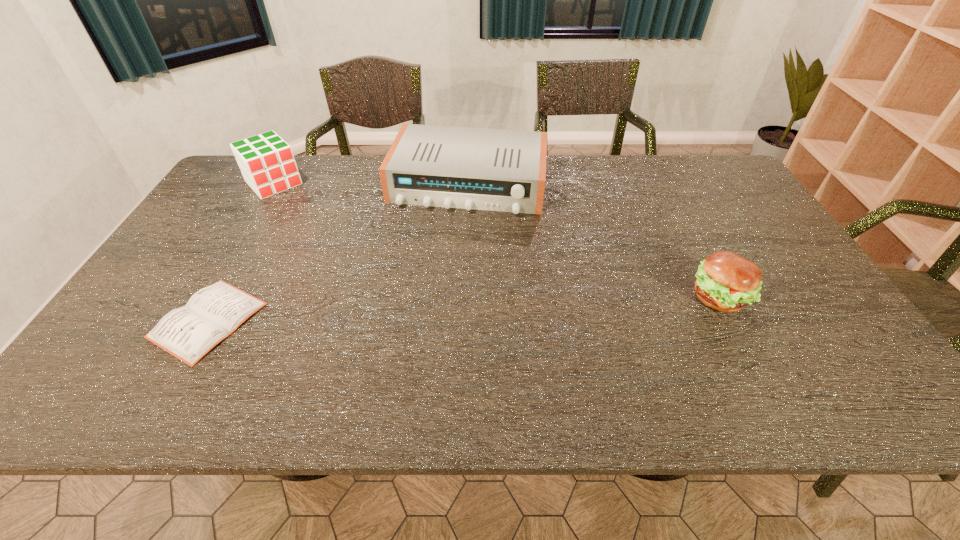
Where is `blank region between the diary and the cube`? The image size is (960, 540). blank region between the diary and the cube is located at coordinates (241, 252).

Where is `unoccupied area between the second object from right to left and the rightmost object`? The image size is (960, 540). unoccupied area between the second object from right to left and the rightmost object is located at coordinates (593, 241).

Where is `empty location between the radio receiver and the hamburger`? This screenshot has height=540, width=960. empty location between the radio receiver and the hamburger is located at coordinates (593, 241).

Where is `vacant space in between the rightmost object and the cube`? vacant space in between the rightmost object and the cube is located at coordinates (496, 240).

Select which object is the third closest to the radio receiver. Please provide its 2D coordinates. Your answer should be formatted as a tuple, i.e. [(x, y)], where the tuple contains the x and y coordinates of a point satisfying the conditions above.

[(726, 282)]

I want to click on the second closest object relative to the rightmost object, so click(x=213, y=313).

Locate an element on the screen. This screenshot has height=540, width=960. free space that satisfies the following two spatial constraints: 1. on the front side of the third object from left to right; 2. on the right side of the cube is located at coordinates (274, 184).

At what (x,y) coordinates should I click in order to perform the action: click on blank area in the image that satisfies the following two spatial constraints: 1. on the back side of the diary; 2. on the right side of the radio receiver. Please return your answer as a coordinate pair (x, y). Looking at the image, I should click on (285, 184).

I want to click on vacant region that satisfies the following two spatial constraints: 1. on the back side of the diary; 2. on the left side of the third object from left to right, so click(x=285, y=184).